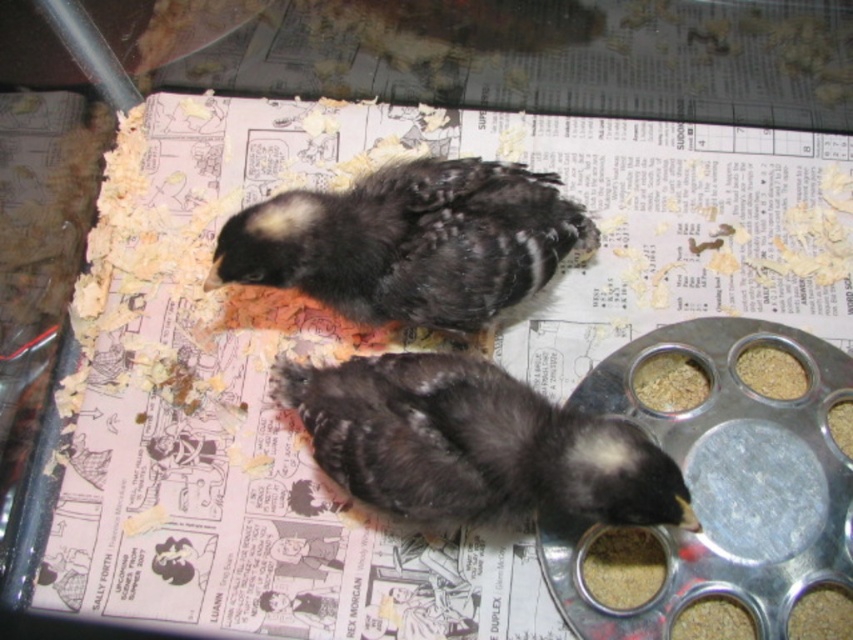
Is dark gray fluffy chick at center wider than brown crumbly food at right?

Correct, the width of dark gray fluffy chick at center exceeds that of brown crumbly food at right.

This screenshot has width=853, height=640. What do you see at coordinates (473, 444) in the screenshot?
I see `dark gray fluffy chick at center` at bounding box center [473, 444].

Locate an element on the screen. dark gray fluffy chick at center is located at coordinates (473, 444).

Where is `dark gray fluffy chick at center`? The width and height of the screenshot is (853, 640). dark gray fluffy chick at center is located at coordinates (473, 444).

Can you confirm if black matte chick at upper center is positioned to the left of brown crumbly food at right?

Indeed, black matte chick at upper center is positioned on the left side of brown crumbly food at right.

Is black matte chick at upper center shorter than brown crumbly food at right?

No, black matte chick at upper center is not shorter than brown crumbly food at right.

Identify the location of black matte chick at upper center. This screenshot has height=640, width=853. (410, 243).

Can you confirm if brown crumbly food at right is bigger than brown grain at right?

Indeed, brown crumbly food at right has a larger size compared to brown grain at right.

Who is lower down, brown crumbly food at right or brown grain at right?

brown crumbly food at right is lower down.

What do you see at coordinates (670, 381) in the screenshot?
I see `brown crumbly food at right` at bounding box center [670, 381].

Where is `brown crumbly food at right`? brown crumbly food at right is located at coordinates (670, 381).